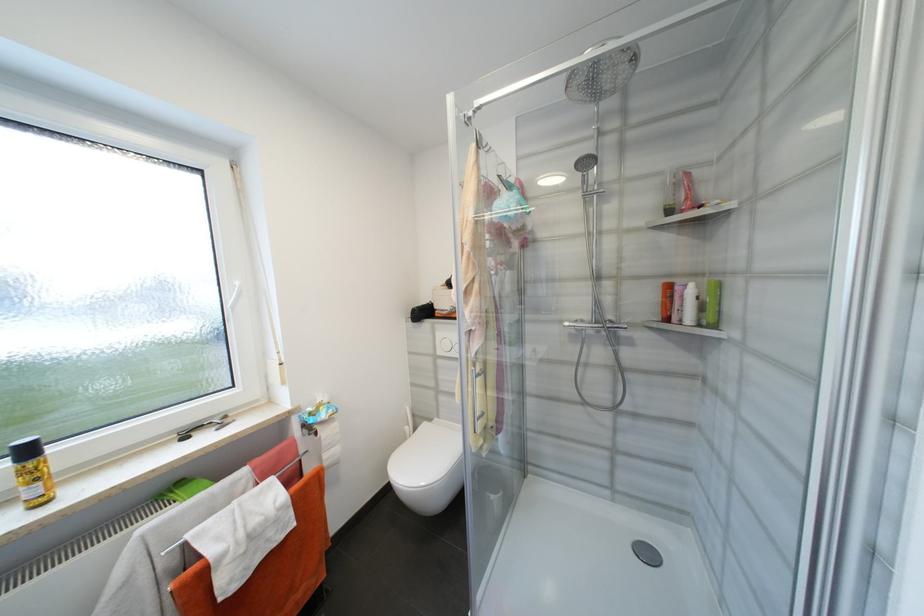
Find where to lift the green shampoo bottle. Please return your answer as a coordinate pair (x, y).

(712, 302)